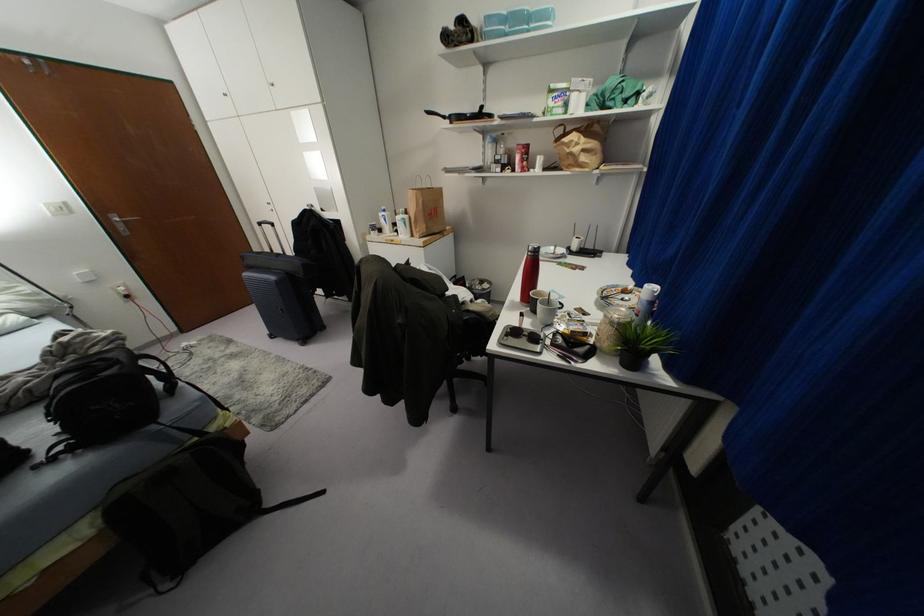
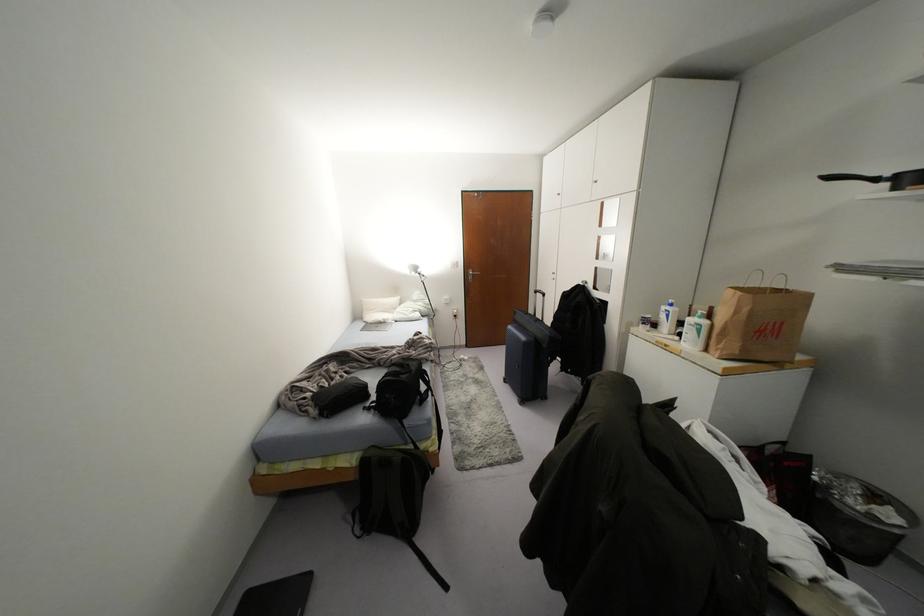
Where in the second image is the point corresponding to (272,224) from the first image?

(542, 294)